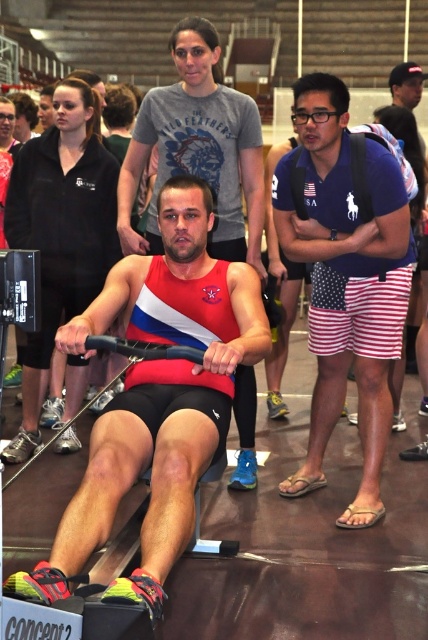
What are the coordinates of the red matte tank top at center?

The red matte tank top at center is located at point (157, 397).

You are a clothing designer observing the gym scene. You notice the red matte tank top at center and the blue cotton polo shirt at center. Which clothing item is wider?

The red matte tank top at center is wider than the blue cotton polo shirt at center.